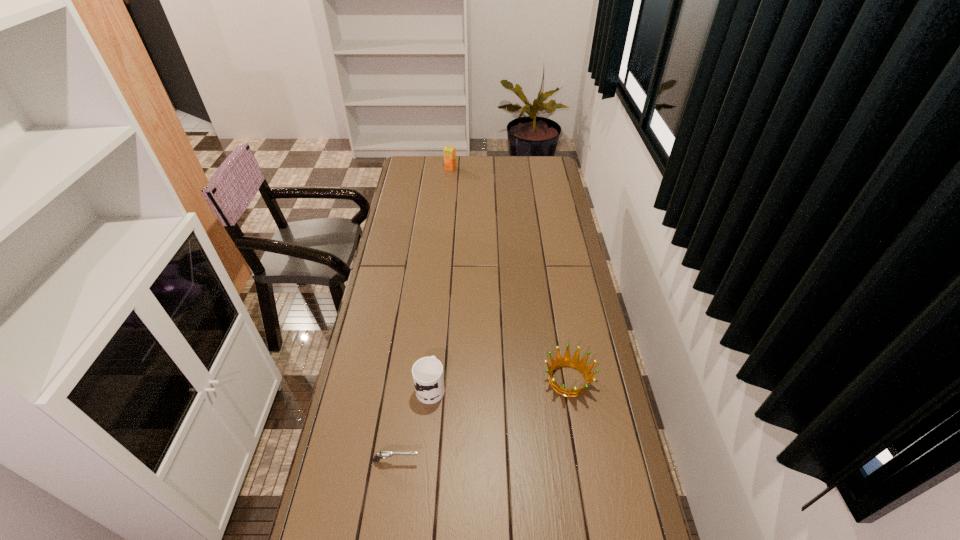
Locate an element on the screen. This screenshot has width=960, height=540. vacant region located on the front of the third tallest object is located at coordinates (588, 500).

At what (x,y) coordinates should I click in order to perform the action: click on vacant space located 0.290m on the front-facing side of the shortest object. Please return your answer as a coordinate pair (x, y). Looking at the image, I should click on (520, 461).

Locate an element on the screen. The width and height of the screenshot is (960, 540). object that is positioned at the far edge is located at coordinates (449, 151).

Where is `object at the left edge`? This screenshot has width=960, height=540. object at the left edge is located at coordinates (385, 454).

Locate an element on the screen. The image size is (960, 540). object that is at the right edge is located at coordinates (567, 361).

This screenshot has width=960, height=540. In order to click on vacant space at the far edge in this screenshot , I will do `click(505, 163)`.

Identify the location of free spot at the left edge of the desktop. (376, 478).

In the image, there is a desktop. Identify the location of blank space at the right edge. This screenshot has height=540, width=960. (608, 395).

This screenshot has width=960, height=540. I want to click on free space at the far left corner, so click(x=427, y=156).

Where is `vacant space in between the mug and the crown`? This screenshot has width=960, height=540. vacant space in between the mug and the crown is located at coordinates (499, 383).